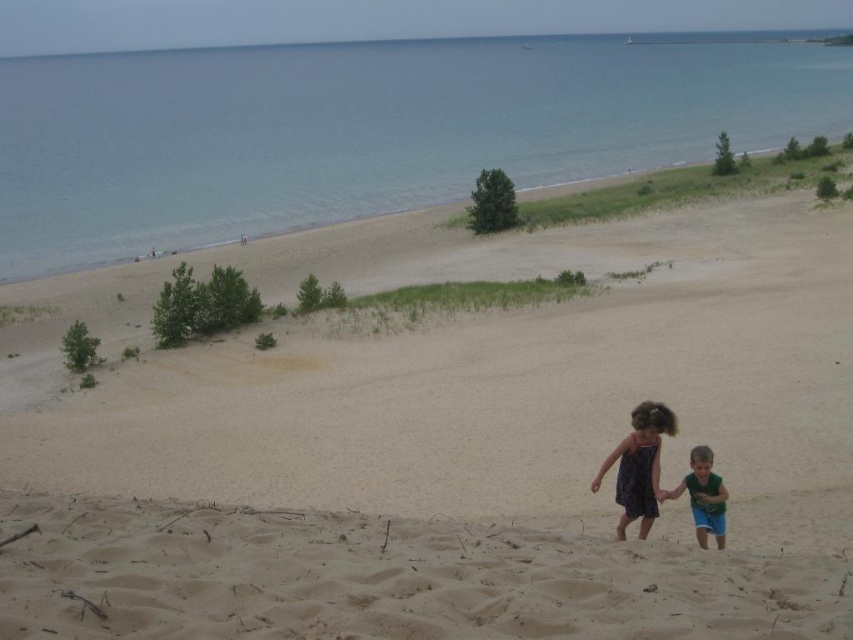
Between blue water at upper center and green cotton shirt at lower right, which one is positioned higher?

blue water at upper center is above.

Is point (654, 129) farther from viewer compared to point (723, 540)?

Yes, it is behind point (723, 540).

Does point (264, 54) come closer to viewer compared to point (709, 481)?

No, (264, 54) is further to viewer.

The image size is (853, 640). Identify the location of blue water at upper center. (367, 131).

Between point (223, 516) and point (724, 492), which one is positioned behind?

Positioned behind is point (724, 492).

Does beige sandy beach at center appear under green cotton shirt at lower right?

No, beige sandy beach at center is not below green cotton shirt at lower right.

Does point (426, 595) lie in front of point (698, 465)?

Yes, it is.

The image size is (853, 640). Identify the location of beige sandy beach at center. (386, 579).

Is point (595, 56) closer to camera compared to point (643, 472)?

No, it is not.

Can you confirm if blue water at upper center is positioned below dark purple dress at lower center?

Incorrect, blue water at upper center is not positioned below dark purple dress at lower center.

Measure the distance between blue water at upper center and camera.

They are 180.18 feet apart.

The width and height of the screenshot is (853, 640). Find the location of `blue water at upper center`. blue water at upper center is located at coordinates (367, 131).